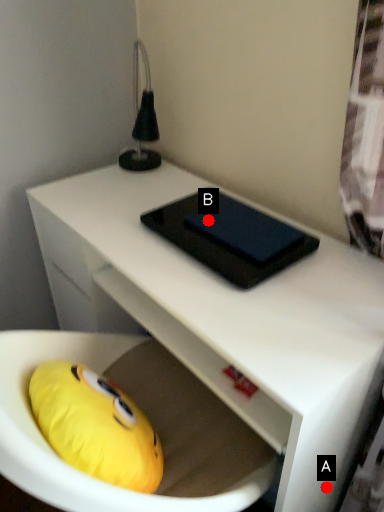
Question: Two points are circled on the image, labeled by A and B beside each circle. Which point appears farthest from the camera in this image?

Choices:
 (A) A is further
 (B) B is further

Answer: (B)